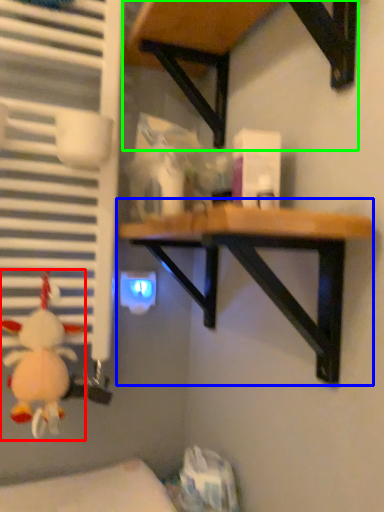
Question: Estimate the real-world distances between objects in this image. Which object is closer to toy (highlighted by a red box), table (highlighted by a blue box) or table (highlighted by a green box)?

Choices:
 (A) table
 (B) table

Answer: (A)